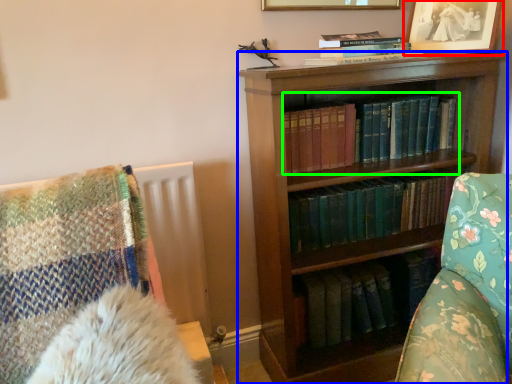
Question: Based on their relative distances, which object is farther from picture frame (highlighted by a red box)? Choose from bookcase (highlighted by a blue box) and book (highlighted by a green box).

Choices:
 (A) bookcase
 (B) book

Answer: (A)